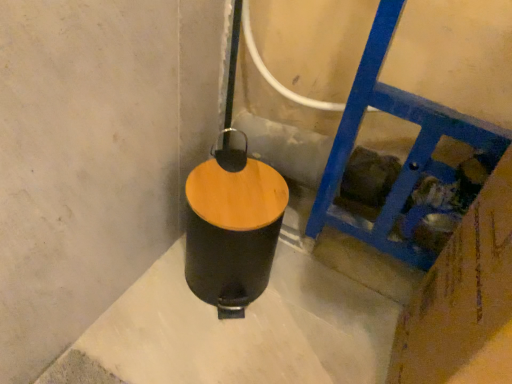
Measure the distance between black matte waste container at center and camera.

25.30 inches.

The image size is (512, 384). What do you see at coordinates (232, 232) in the screenshot? I see `black matte waste container at center` at bounding box center [232, 232].

Where is `black matte waste container at center`? The width and height of the screenshot is (512, 384). black matte waste container at center is located at coordinates (232, 232).

Looking at this image, what is the approximate width of blue painted wood at right?

blue painted wood at right is 13.85 inches in width.

This screenshot has width=512, height=384. Describe the element at coordinates (410, 150) in the screenshot. I see `blue painted wood at right` at that location.

You are a GUI agent. You are given a task and a screenshot of the screen. Output one action in this format:
    pyautogui.click(x=<x>, y=<y>)
    Task: Click on the blue painted wood at right
    Image resolution: width=512 pixels, height=384 pixels.
    Given the screenshot: What is the action you would take?
    pyautogui.click(x=410, y=150)

Image resolution: width=512 pixels, height=384 pixels. I want to click on black matte waste container at center, so click(x=232, y=232).

Between blue painted wood at right and black matte waste container at center, which one appears on the right side from the viewer's perspective?

blue painted wood at right is more to the right.

Relative to black matte waste container at center, is blue painted wood at right in front or behind?

blue painted wood at right is in front of black matte waste container at center.

Does point (454, 118) come farther from viewer compared to point (237, 217)?

No, it is not.

From the image's perspective, would you say blue painted wood at right is shown under black matte waste container at center?

Yes.

From a real-world perspective, is blue painted wood at right physically below black matte waste container at center?

Incorrect, from a real-world perspective, blue painted wood at right is higher than black matte waste container at center.

Does blue painted wood at right have a greater width compared to black matte waste container at center?

Correct, the width of blue painted wood at right exceeds that of black matte waste container at center.

Between blue painted wood at right and black matte waste container at center, which one has less height?

black matte waste container at center is shorter.

Can you confirm if blue painted wood at right is bigger than black matte waste container at center?

Indeed, blue painted wood at right has a larger size compared to black matte waste container at center.

Looking at this image, is blue painted wood at right outside of black matte waste container at center?

Yes, blue painted wood at right is located beyond the bounds of black matte waste container at center.

Looking at this image, is blue painted wood at right far away from black matte waste container at center?

They are positioned close to each other.

Is blue painted wood at right aimed at black matte waste container at center?

No, blue painted wood at right is not turned towards black matte waste container at center.

Locate an element on the screen. The image size is (512, 384). ladder positioned vertically above the black matte waste container at center (from a real-world perspective) is located at coordinates (410, 150).

Which is more to the right, black matte waste container at center or blue painted wood at right?

Positioned to the right is blue painted wood at right.

Which object is closer to the camera, black matte waste container at center or blue painted wood at right?

Positioned in front is blue painted wood at right.

Does point (256, 216) appear closer or farther from the camera than point (418, 99)?

Point (256, 216) is farther from the camera than point (418, 99).

From the image's perspective, which is below, black matte waste container at center or blue painted wood at right?

blue painted wood at right, from the image's perspective.

From a real-world perspective, is black matte waste container at center located higher than blue painted wood at right?

No, from a real-world perspective, black matte waste container at center is not over blue painted wood at right

Considering the sizes of objects black matte waste container at center and blue painted wood at right in the image provided, who is thinner, black matte waste container at center or blue painted wood at right?

black matte waste container at center.

Who is shorter, black matte waste container at center or blue painted wood at right?

black matte waste container at center is shorter.

Who is smaller, black matte waste container at center or blue painted wood at right?

black matte waste container at center.

Can blue painted wood at right be found inside black matte waste container at center?

That's incorrect, blue painted wood at right is not inside black matte waste container at center.

Is black matte waste container at center not near blue painted wood at right?

black matte waste container at center is actually quite close to blue painted wood at right.

Is black matte waste container at center facing away from blue painted wood at right?

black matte waste container at center is not turned away from blue painted wood at right.

How distant is black matte waste container at center from blue painted wood at right?

The distance of black matte waste container at center from blue painted wood at right is 8.60 inches.

Locate an element on the screen. waste container located on the left of blue painted wood at right is located at coordinates (232, 232).

Locate an element on the screen. Image resolution: width=512 pixels, height=384 pixels. waste container that appears behind the blue painted wood at right is located at coordinates (232, 232).

You are a GUI agent. You are given a task and a screenshot of the screen. Output one action in this format:
    pyautogui.click(x=<x>, y=<y>)
    Task: Click on the ladder below the black matte waste container at center (from the image's perspective)
    This screenshot has width=512, height=384.
    Given the screenshot: What is the action you would take?
    pyautogui.click(x=410, y=150)